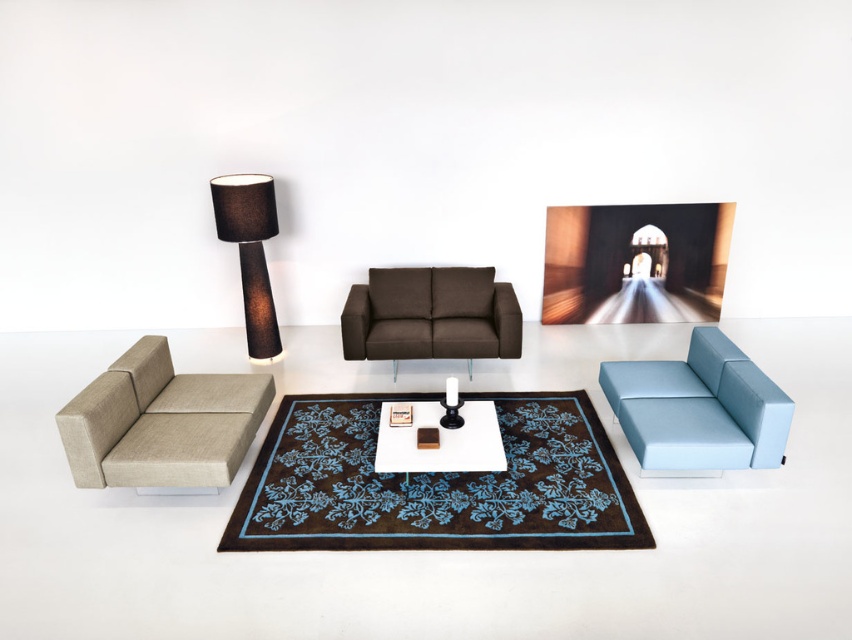
You are a guest entering the living room and want to sit down. Which armchair, the beige fabric armchair at left or the light blue fabric armchair at right, would you choose if you prefer a taller seat?

The beige fabric armchair at left is much taller than the light blue fabric armchair at right, so you should choose the beige fabric armchair at left for a taller seat.

You are a guest entering the living room and want to place your bag on the nearest table. You see the black fabric lamp at upper left and the white glossy table at center. Which object is closer to you?

The black fabric lamp at upper left is to the left of white glossy table at center, so the black fabric lamp at upper left is closer to you.